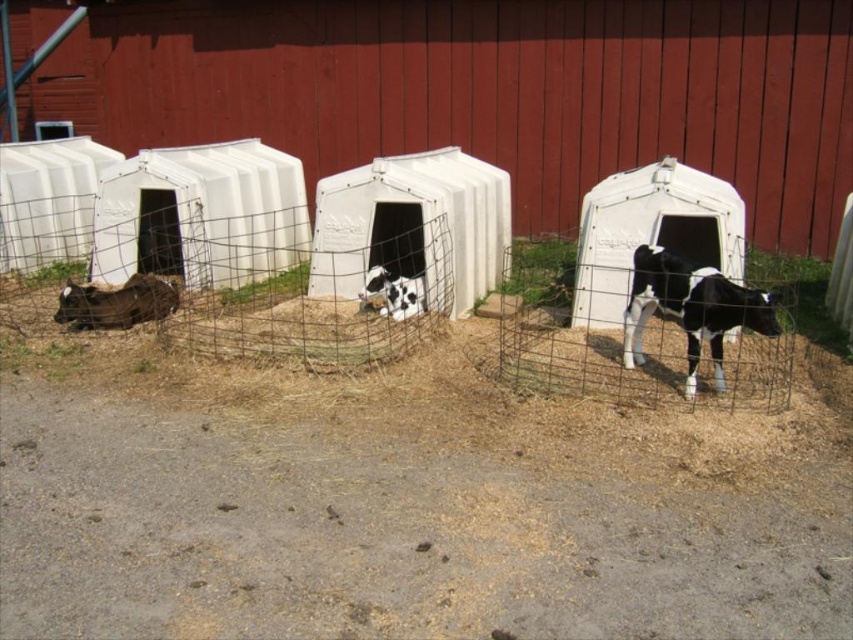
You are standing in the fenced area near the red barn and want to walk from the point at coordinates point (x=131, y=305) to the point at coordinates point (x=372, y=296). Which direction should you move to get closer to your destination?

To move from point (x=131, y=305) to point (x=372, y=296), you should move downward and to the left because point (x=372, y=296) is further away from the viewer compared to point (x=131, y=305).